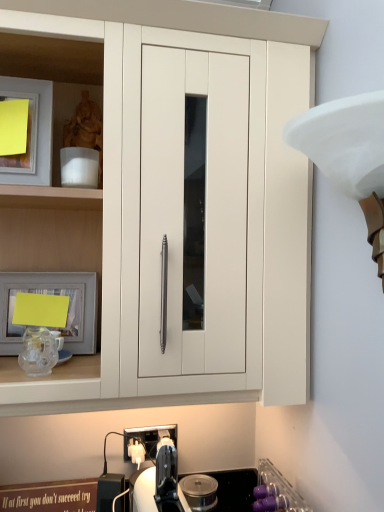
Measure the distance between point (63,278) and camera.

Point (63,278) and camera are 1.05 meters apart from each other.

Locate an element on the screen. The width and height of the screenshot is (384, 512). white matte lampshade at upper right is located at coordinates (349, 155).

Locate an element on the screen. The image size is (384, 512). electric outlet below the matte silver picture frame at left (from the image's perspective) is located at coordinates (148, 439).

From a real-world perspective, between matte silver picture frame at left and white plastic electric outlet at lower center, who is vertically higher?

matte silver picture frame at left is physically above.

Is matte silver picture frame at left positioned behind white plastic electric outlet at lower center?

No, matte silver picture frame at left is closer to the viewer.

In order to click on cabinetry directly beneath the white matte lampshade at upper right (from a real-world perspective) in this screenshot , I will do `click(249, 198)`.

From the image's perspective, does matte white cabinet at center appear higher than white matte lampshade at upper right?

Correct, matte white cabinet at center appears higher than white matte lampshade at upper right in the image.

Is matte white cabinet at center spatially inside white matte lampshade at upper right, or outside of it?

matte white cabinet at center exists outside the volume of white matte lampshade at upper right.

What's the angular difference between matte white cabinet at center and white matte lampshade at upper right's facing directions?

There is a 92-degree angle between the facing directions of matte white cabinet at center and white matte lampshade at upper right.

You are a GUI agent. You are given a task and a screenshot of the screen. Output one action in this format:
    pyautogui.click(x=<x>, y=<y>)
    Task: Click on the picture frame that appears on the left of purple plastic cups at lower right
    This screenshot has width=384, height=512.
    Given the screenshot: What is the action you would take?
    pyautogui.click(x=52, y=294)

Considering the sizes of objects purple plastic cups at lower right and matte silver picture frame at left in the image provided, who is taller, purple plastic cups at lower right or matte silver picture frame at left?

With more height is purple plastic cups at lower right.

Is the position of purple plastic cups at lower right more distant than that of matte silver picture frame at left?

No.

How much distance is there between purple plastic cups at lower right and matte silver picture frame at left?

24.19 inches.

How different are the orientations of white plastic electric outlet at lower center and matte white cabinet at center in degrees?

The angle between the facing direction of white plastic electric outlet at lower center and the facing direction of matte white cabinet at center is 0.378 degrees.

Considering the positions of point (152, 447) and point (16, 21), is point (152, 447) closer or farther from the camera than point (16, 21)?

Clearly, point (152, 447) is more distant from the camera than point (16, 21).

Can you confirm if white plastic electric outlet at lower center is shorter than matte white cabinet at center?

Indeed, white plastic electric outlet at lower center has a lesser height compared to matte white cabinet at center.

Considering the positions of objects white plastic electric outlet at lower center and matte white cabinet at center in the image provided, who is behind, white plastic electric outlet at lower center or matte white cabinet at center?

white plastic electric outlet at lower center.

The width and height of the screenshot is (384, 512). Find the location of `table lamp in front of the matte white cabinet at center`. table lamp in front of the matte white cabinet at center is located at coordinates (349, 155).

Considering the sizes of white matte lampshade at upper right and matte white cabinet at center in the image, is white matte lampshade at upper right taller or shorter than matte white cabinet at center?

Considering their sizes, white matte lampshade at upper right has less height than matte white cabinet at center.

Would you say white matte lampshade at upper right is inside or outside matte white cabinet at center?

white matte lampshade at upper right exists outside the volume of matte white cabinet at center.

Is white matte lampshade at upper right turned away from matte white cabinet at center?

white matte lampshade at upper right is not turned away from matte white cabinet at center.

Is point (268, 38) more distant than point (282, 505)?

No, (268, 38) is in front of (282, 505).

This screenshot has width=384, height=512. What are the coordinates of `cabinetry lying in front of the purple plastic cups at lower right` in the screenshot? It's located at (249, 198).

From the image's perspective, is matte white cabinet at center beneath purple plastic cups at lower right?

Incorrect, from the image's perspective, matte white cabinet at center is higher than purple plastic cups at lower right.

Is matte white cabinet at center facing towards purple plastic cups at lower right?

No, matte white cabinet at center is not aimed at purple plastic cups at lower right.

I want to click on electric outlet that appears below the white matte lampshade at upper right (from the image's perspective), so click(x=148, y=439).

Is white plastic electric outlet at lower center looking in the opposite direction of white matte lampshade at upper right?

No.

Consider the image. Considering the sizes of objects white plastic electric outlet at lower center and white matte lampshade at upper right in the image provided, who is wider, white plastic electric outlet at lower center or white matte lampshade at upper right?

Wider between the two is white matte lampshade at upper right.

The image size is (384, 512). What are the coordinates of `picture frame that is on the left side of white plastic electric outlet at lower center` in the screenshot? It's located at (52, 294).

Where is `cabinetry located underneath the white matte lampshade at upper right (from a real-world perspective)`? This screenshot has width=384, height=512. cabinetry located underneath the white matte lampshade at upper right (from a real-world perspective) is located at coordinates (249, 198).

From the image, which object appears to be nearer to purple plastic cups at lower right, white matte lampshade at upper right or matte silver picture frame at left?

The object closer to purple plastic cups at lower right is matte silver picture frame at left.

Considering their positions, is white matte lampshade at upper right positioned further to matte white cabinet at center than purple plastic cups at lower right?

Based on the image, purple plastic cups at lower right appears to be further to matte white cabinet at center.

Estimate the real-world distances between objects in this image. Which object is further from matte silver picture frame at left, white matte lampshade at upper right or white plastic electric outlet at lower center?

The object further to matte silver picture frame at left is white matte lampshade at upper right.

Looking at the image, which one is located further to matte white cabinet at center, purple plastic cups at lower right or white plastic electric outlet at lower center?

Based on the image, white plastic electric outlet at lower center appears to be further to matte white cabinet at center.

Which object lies further to the anchor point white matte lampshade at upper right, matte silver picture frame at left or white plastic electric outlet at lower center?

white plastic electric outlet at lower center is further to white matte lampshade at upper right.

Looking at the image, which one is located closer to white plastic electric outlet at lower center, matte silver picture frame at left or matte white cabinet at center?

matte silver picture frame at left is positioned closer to the anchor white plastic electric outlet at lower center.

Considering their positions, is matte white cabinet at center positioned further to matte silver picture frame at left than purple plastic cups at lower right?

purple plastic cups at lower right.

Which object lies further to the anchor point white plastic electric outlet at lower center, purple plastic cups at lower right or matte silver picture frame at left?

matte silver picture frame at left lies further to white plastic electric outlet at lower center than the other object.

You are a GUI agent. You are given a task and a screenshot of the screen. Output one action in this format:
    pyautogui.click(x=<x>, y=<y>)
    Task: Click on the cabinetry between matte silver picture frame at left and white matte lampshade at upper right
    The height and width of the screenshot is (512, 384).
    Given the screenshot: What is the action you would take?
    pyautogui.click(x=249, y=198)

This screenshot has height=512, width=384. I want to click on picture frame between white matte lampshade at upper right and white plastic electric outlet at lower center along the z-axis, so click(52, 294).

Locate an element on the screen. Image resolution: width=384 pixels, height=512 pixels. electric outlet between white matte lampshade at upper right and purple plastic cups at lower right vertically is located at coordinates (148, 439).

Locate an element on the screen. The image size is (384, 512). electric outlet between matte white cabinet at center and purple plastic cups at lower right in the vertical direction is located at coordinates (148, 439).